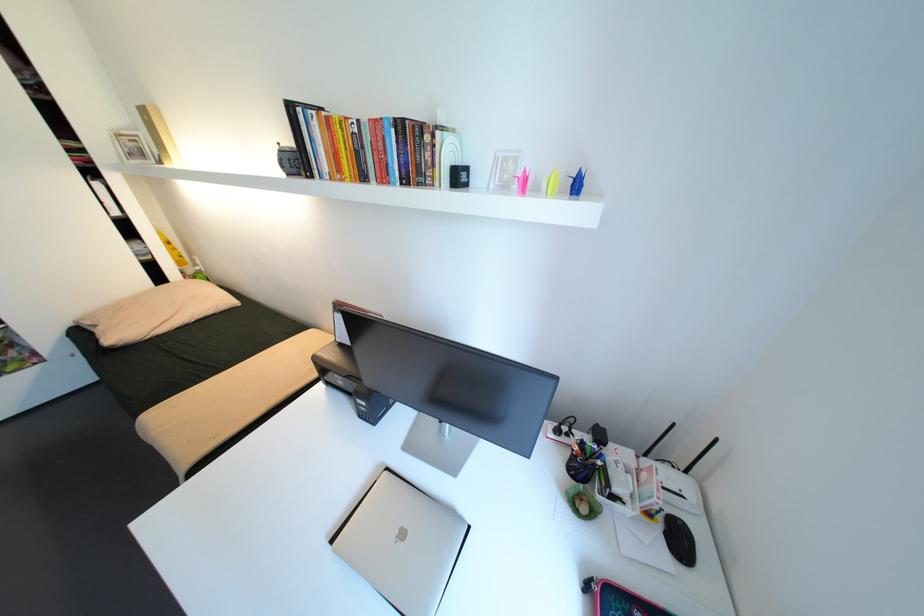
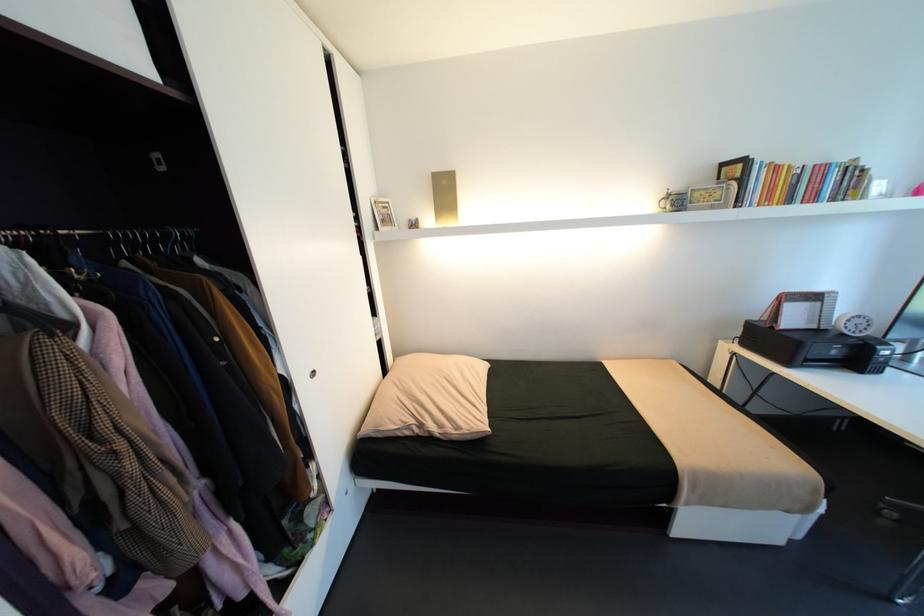
Find the pixel in the second image that matches point 377,121 in the first image.

(821, 166)